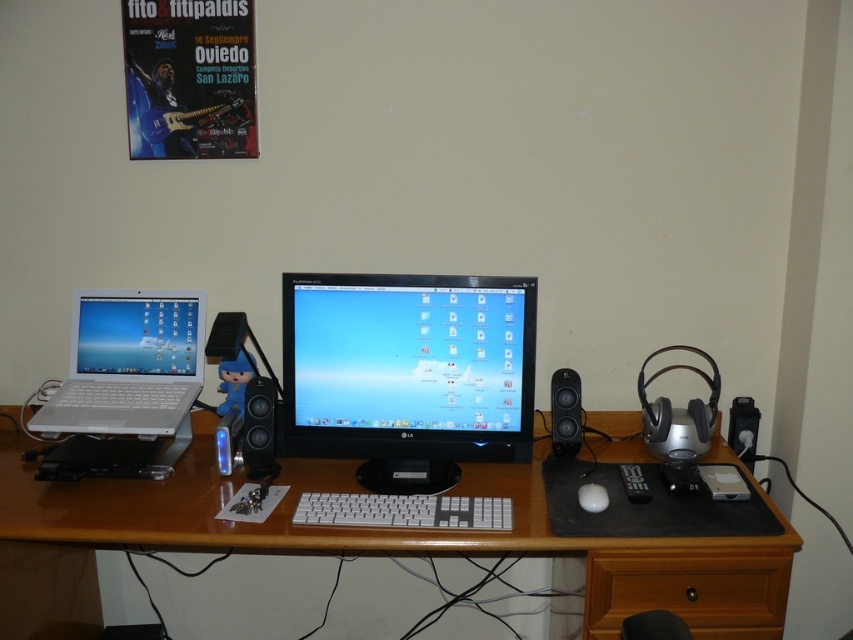
Which is in front, point (61, 529) or point (583, 508)?

Positioned in front is point (61, 529).

Can you confirm if wooden at center is smaller than white matte mouse at center?

Incorrect, wooden at center is not smaller in size than white matte mouse at center.

In order to click on wooden at center in this screenshot , I will do `click(357, 545)`.

Which is more to the right, white plastic keyboard at center or matte black speaker at center?

Positioned to the right is white plastic keyboard at center.

Describe the element at coordinates (404, 512) in the screenshot. I see `white plastic keyboard at center` at that location.

You are a GUI agent. You are given a task and a screenshot of the screen. Output one action in this format:
    pyautogui.click(x=<x>, y=<y>)
    Task: Click on the white plastic keyboard at center
    
    Given the screenshot: What is the action you would take?
    pyautogui.click(x=404, y=512)

Which is above, wooden at center or matte black speaker at center?

Positioned higher is matte black speaker at center.

Measure the distance between wooden at center and matte black speaker at center.

The distance of wooden at center from matte black speaker at center is 12.45 inches.

Image resolution: width=853 pixels, height=640 pixels. What are the coordinates of `wooden at center` in the screenshot? It's located at (357, 545).

I want to click on wooden at center, so click(357, 545).